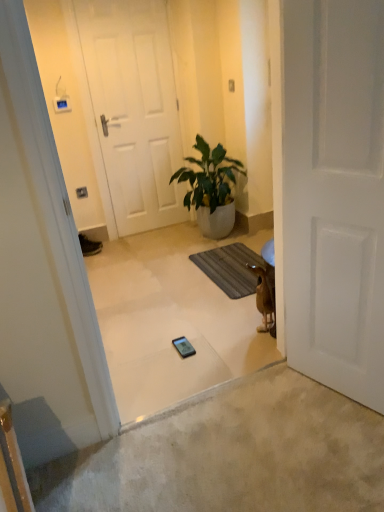
Question: Considering their positions, is white matte door at center, marked as the 2th door in a front-to-back arrangement, located in front of or behind brown furry dog at lower right?

Choices:
 (A) behind
 (B) front

Answer: (A)

Question: From a real-world perspective, is white matte door at center, the 2th door in the right-to-left sequence, physically located above or below brown furry dog at lower right?

Choices:
 (A) below
 (B) above

Answer: (B)

Question: Considering the real-world distances, which object is farthest from the white matte door at center, marked as the 2th door in a front-to-back arrangement?

Choices:
 (A) matte black phone at center
 (B) brown furry dog at lower right
 (C) white matte door at right, which is the first door from front to back
 (D) green glossy plant at center
 (E) brown textured bath mat at center

Answer: (C)

Question: Considering the real-world distances, which object is closest to the brown textured bath mat at center?

Choices:
 (A) matte black sneaker at lower left
 (B) brown furry dog at lower right
 (C) green glossy plant at center
 (D) white matte door at right, which is the second door from back to front
 (E) white matte door at center, arranged as the 1th door when viewed from the back

Answer: (C)